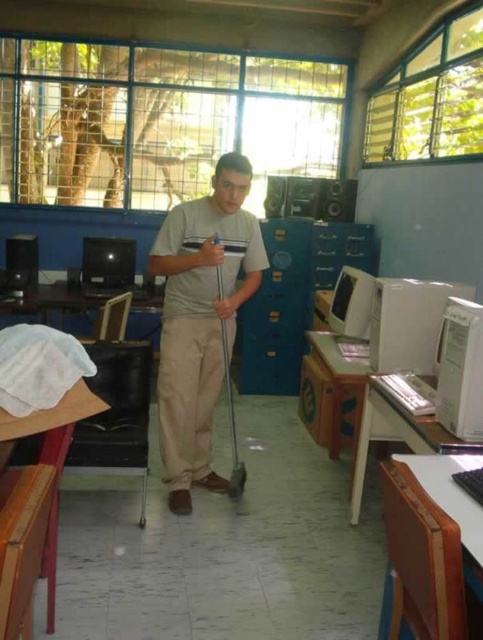
Question: Is shiny black monitor at center closer to the viewer compared to metallic silver shovel at center?

Choices:
 (A) no
 (B) yes

Answer: (A)

Question: Which of the following is the closest to the observer?

Choices:
 (A) metallic silver shovel at center
 (B) beige cotton pants at center
 (C) matte black speaker at left

Answer: (B)

Question: Does beige cotton pants at center have a larger size compared to metallic silver shovel at center?

Choices:
 (A) yes
 (B) no

Answer: (A)

Question: Which object appears closest to the camera in this image?

Choices:
 (A) matte black speaker at left
 (B) shiny black monitor at center

Answer: (A)

Question: Which object appears closest to the camera in this image?

Choices:
 (A) shiny black monitor at center
 (B) white plastic computer tower at right
 (C) beige cotton pants at center

Answer: (B)

Question: Does shiny black monitor at center appear on the right side of matte black speaker at left?

Choices:
 (A) yes
 (B) no

Answer: (A)